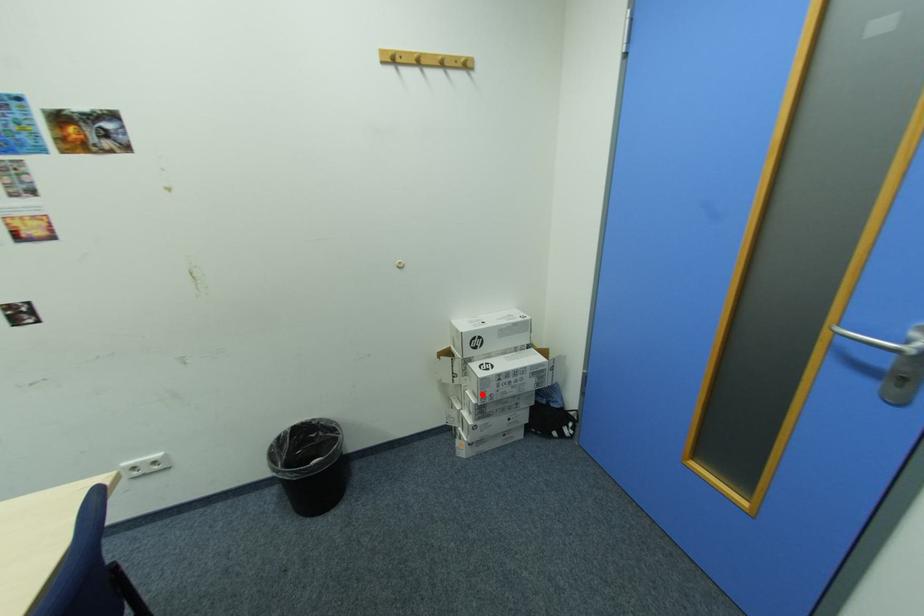
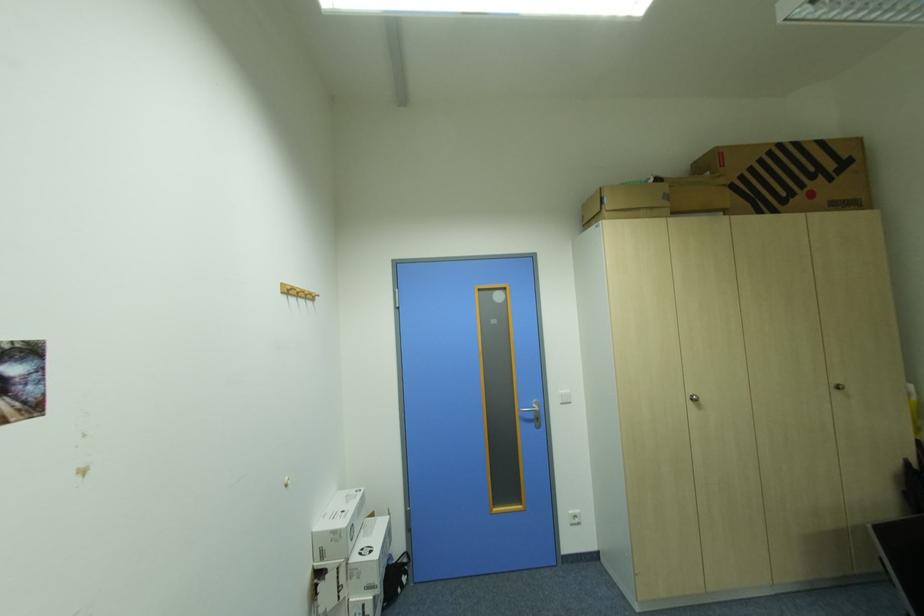
The point at the highlighted location is marked in the first image. Where is the corresponding point in the second image?

(377, 590)